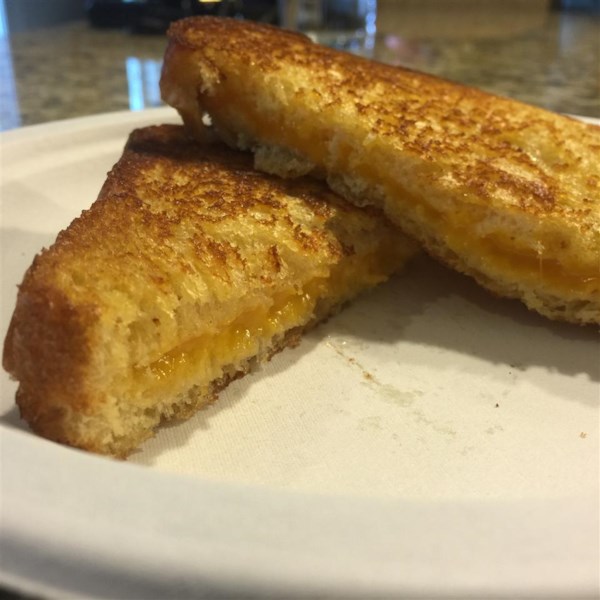
Locate an element on the screen. This screenshot has height=600, width=600. counter is located at coordinates (69, 65).